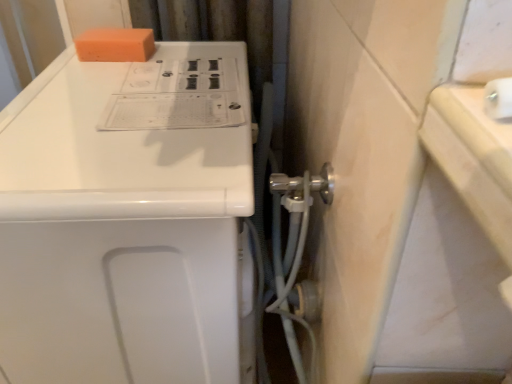
Question: Is orange sponge at upper left in contact with white glossy washing machine at upper left?

Choices:
 (A) yes
 (B) no

Answer: (B)

Question: Would you consider orange sponge at upper left to be distant from white glossy washing machine at upper left?

Choices:
 (A) yes
 (B) no

Answer: (B)

Question: Can you confirm if orange sponge at upper left is taller than white glossy washing machine at upper left?

Choices:
 (A) yes
 (B) no

Answer: (B)

Question: Is white glossy washing machine at upper left surrounded by orange sponge at upper left?

Choices:
 (A) yes
 (B) no

Answer: (B)

Question: From a real-world perspective, is orange sponge at upper left located beneath white glossy washing machine at upper left?

Choices:
 (A) no
 (B) yes

Answer: (A)

Question: Is orange sponge at upper left to the left of white glossy washing machine at upper left from the viewer's perspective?

Choices:
 (A) no
 (B) yes

Answer: (B)

Question: Is white glossy washing machine at upper left closer to camera compared to orange sponge at upper left?

Choices:
 (A) yes
 (B) no

Answer: (A)

Question: Can you confirm if white glossy washing machine at upper left is thinner than orange sponge at upper left?

Choices:
 (A) yes
 (B) no

Answer: (B)

Question: Is orange sponge at upper left located within white glossy washing machine at upper left?

Choices:
 (A) no
 (B) yes

Answer: (B)

Question: From the image's perspective, is white glossy washing machine at upper left below orange sponge at upper left?

Choices:
 (A) no
 (B) yes

Answer: (B)

Question: Is white glossy washing machine at upper left positioned with its back to orange sponge at upper left?

Choices:
 (A) yes
 (B) no

Answer: (B)

Question: Is white glossy washing machine at upper left smaller than orange sponge at upper left?

Choices:
 (A) no
 (B) yes

Answer: (A)

Question: Does point (94, 34) appear closer or farther from the camera than point (177, 107)?

Choices:
 (A) closer
 (B) farther

Answer: (B)